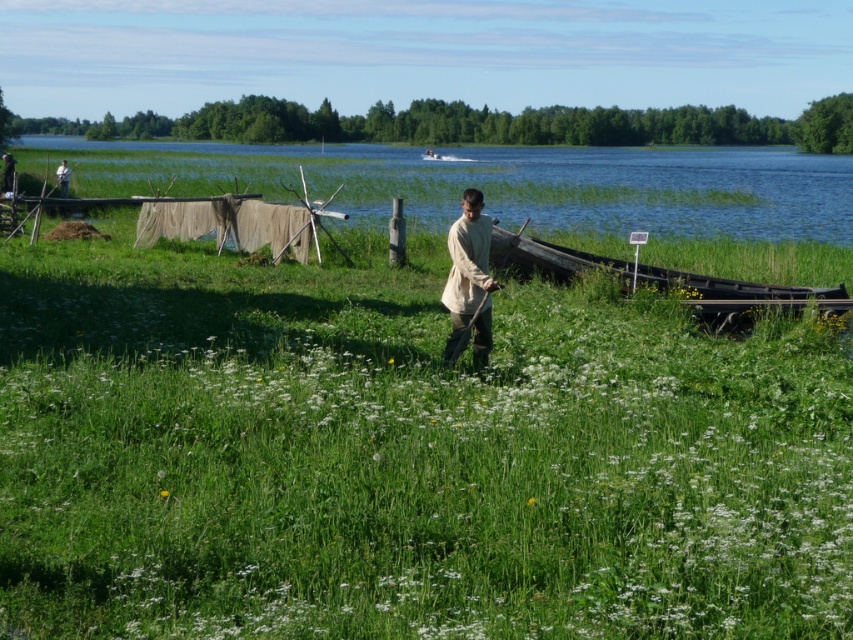
You are a drone operator trying to capture the green grassy area at center in a photo. The drone is currently hovering at point 0.5, 0.5. Which direction should you move the drone to get closer to the green grassy at center?

The green grassy at center is located at point [404,456]. Since the drone is at [426,320], you should move it northeast to reach the grassy area.

Consider the image. You are a hiker who wants to cross the lake using the boat. The boat is near the edge of the water. Can you reach the blue water at upper center from the boat without getting your light beige fabric shirt at center wet?

The blue water at upper center is above the light beige fabric shirt at center, so it is higher in position. Since the boat is near the edge of the water, you can reach the blue water at upper center from the boat without getting your light beige fabric shirt at center wet as long as you stay in the boat and avoid stepping into the water.